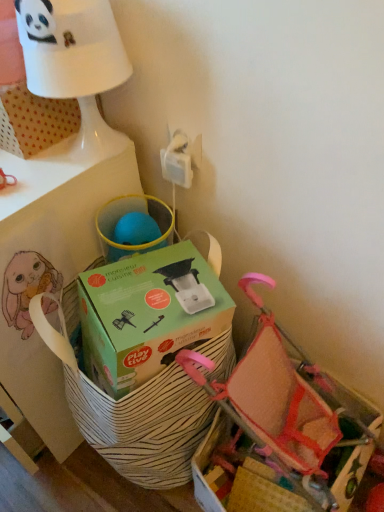
Question: Can you confirm if white matte table at upper left is wider than pink mesh baby carriage at lower right?

Choices:
 (A) no
 (B) yes

Answer: (B)

Question: Can you confirm if white matte table at upper left is taller than pink mesh baby carriage at lower right?

Choices:
 (A) no
 (B) yes

Answer: (B)

Question: Is white matte table at upper left not inside pink mesh baby carriage at lower right?

Choices:
 (A) no
 (B) yes

Answer: (B)

Question: Does white matte table at upper left appear on the left side of pink mesh baby carriage at lower right?

Choices:
 (A) yes
 (B) no

Answer: (A)

Question: Is white matte table at upper left not close to pink mesh baby carriage at lower right?

Choices:
 (A) yes
 (B) no

Answer: (B)

Question: From a real-world perspective, is white matte table at upper left above or below green cardboard box at center?

Choices:
 (A) below
 (B) above

Answer: (A)

Question: Looking at their shapes, would you say white matte table at upper left is wider or thinner than green cardboard box at center?

Choices:
 (A) wide
 (B) thin

Answer: (A)

Question: From their relative heights in the image, would you say white matte table at upper left is taller or shorter than green cardboard box at center?

Choices:
 (A) tall
 (B) short

Answer: (A)

Question: Do you think white matte table at upper left is within green cardboard box at center, or outside of it?

Choices:
 (A) outside
 (B) inside

Answer: (A)

Question: From the image's perspective, is white glossy table lamp at upper left above or below pink mesh baby carriage at lower right?

Choices:
 (A) below
 (B) above

Answer: (B)

Question: Is point (87, 79) positioned closer to the camera than point (269, 317)?

Choices:
 (A) closer
 (B) farther

Answer: (A)

Question: Is white glossy table lamp at upper left bigger or smaller than pink mesh baby carriage at lower right?

Choices:
 (A) big
 (B) small

Answer: (B)

Question: Considering the positions of white glossy table lamp at upper left and pink mesh baby carriage at lower right in the image, is white glossy table lamp at upper left taller or shorter than pink mesh baby carriage at lower right?

Choices:
 (A) tall
 (B) short

Answer: (B)

Question: Looking at their shapes, would you say green cardboard box at center is wider or thinner than pink mesh baby carriage at lower right?

Choices:
 (A) thin
 (B) wide

Answer: (A)

Question: Considering the positions of green cardboard box at center and pink mesh baby carriage at lower right in the image, is green cardboard box at center bigger or smaller than pink mesh baby carriage at lower right?

Choices:
 (A) small
 (B) big

Answer: (A)